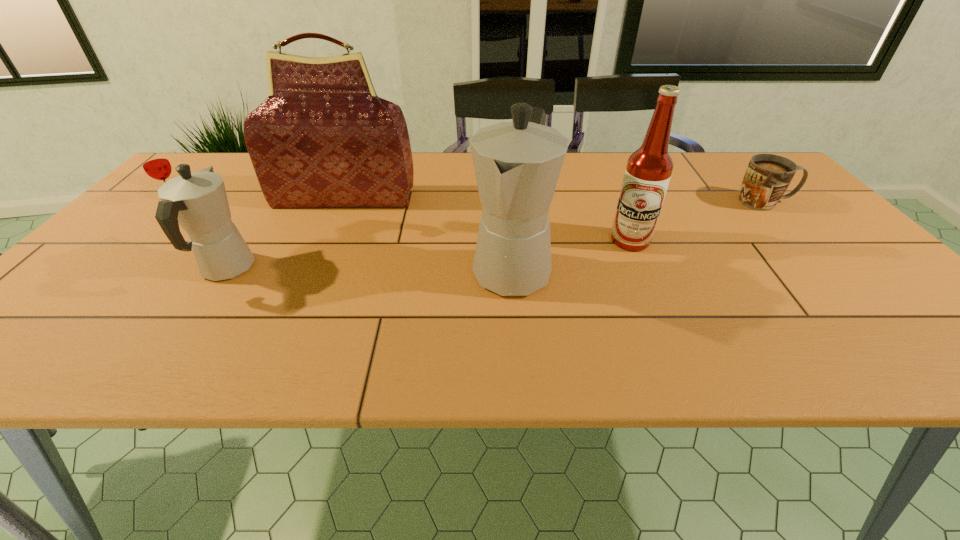
Where is `object that is the fifth closest to the fourth object from left to right`? The width and height of the screenshot is (960, 540). object that is the fifth closest to the fourth object from left to right is located at coordinates (155, 163).

At what (x,y) coordinates should I click in order to perform the action: click on object that can be found as the closest to the alcohol. Please return your answer as a coordinate pair (x, y). Looking at the image, I should click on (517, 164).